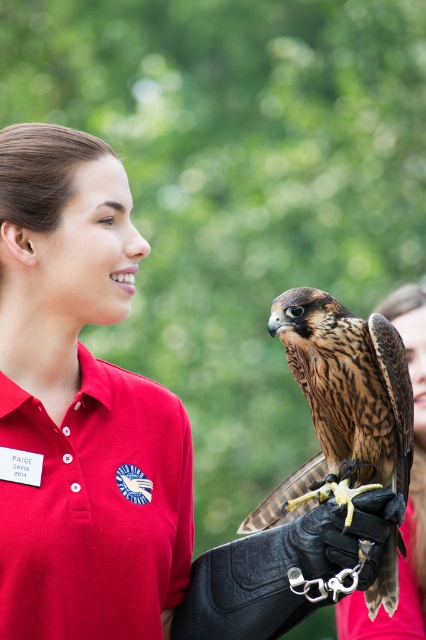
Is matte red polo shirt at center further to camera compared to brown speckled feathers at center?

No, it is in front of brown speckled feathers at center.

Identify the location of matte red polo shirt at center. (94, 508).

This screenshot has width=426, height=640. I want to click on matte red polo shirt at center, so click(x=94, y=508).

Does brown speckled feathers at center appear on the left side of matte red glove at center?

Indeed, brown speckled feathers at center is positioned on the left side of matte red glove at center.

The image size is (426, 640). Describe the element at coordinates (342, 401) in the screenshot. I see `brown speckled feathers at center` at that location.

Who is more forward, (371, 611) or (417, 596)?

Point (371, 611)

Find the location of a particular element. The width and height of the screenshot is (426, 640). brown speckled feathers at center is located at coordinates (342, 401).

Is matte red polo shirt at center shorter than matte red glove at center?

Yes.

Does matte red polo shirt at center appear on the left side of matte red glove at center?

Indeed, matte red polo shirt at center is positioned on the left side of matte red glove at center.

The image size is (426, 640). Describe the element at coordinates (94, 508) in the screenshot. I see `matte red polo shirt at center` at that location.

This screenshot has width=426, height=640. In order to click on matte red polo shirt at center in this screenshot , I will do `click(94, 508)`.